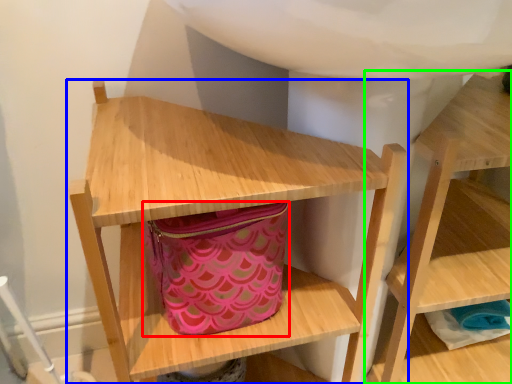
Question: Estimate the real-world distances between objects in this image. Which object is closer to bag (highlighted by a red box), shelf (highlighted by a blue box) or shelf (highlighted by a green box)?

Choices:
 (A) shelf
 (B) shelf

Answer: (A)